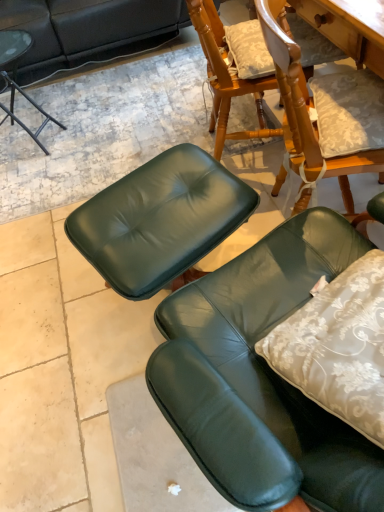
Question: Is green leather chair at lower right, which is the 2th chair from top to bottom, situated inside matte black side table at upper left, marked as the second chair in a right-to-left arrangement, or outside?

Choices:
 (A) inside
 (B) outside

Answer: (B)

Question: From a real-world perspective, is green leather chair at lower right, marked as the second chair in a left-to-right arrangement, positioned above or below matte black side table at upper left, which appears as the 2th chair when viewed from the front?

Choices:
 (A) above
 (B) below

Answer: (A)

Question: From their relative heights in the image, would you say green leather chair at lower right, positioned as the first chair in right-to-left order, is taller or shorter than matte black side table at upper left, positioned as the first chair in top-to-bottom order?

Choices:
 (A) tall
 (B) short

Answer: (A)

Question: Is matte black side table at upper left, marked as the second chair in a right-to-left arrangement, taller or shorter than green leather chair at lower right, the 1th chair from the bottom?

Choices:
 (A) tall
 (B) short

Answer: (B)

Question: Would you say matte black side table at upper left, positioned as the first chair in top-to-bottom order, is to the left or to the right of green leather chair at lower right, marked as the second chair in a left-to-right arrangement, in the picture?

Choices:
 (A) right
 (B) left

Answer: (B)

Question: In terms of width, does matte black side table at upper left, which appears as the 2th chair when viewed from the front, look wider or thinner when compared to green leather chair at lower right, positioned as the first chair in right-to-left order?

Choices:
 (A) wide
 (B) thin

Answer: (A)

Question: From the image's perspective, is matte black side table at upper left, which appears as the 2th chair when viewed from the front, positioned above or below green leather chair at lower right, marked as the second chair in a left-to-right arrangement?

Choices:
 (A) above
 (B) below

Answer: (A)